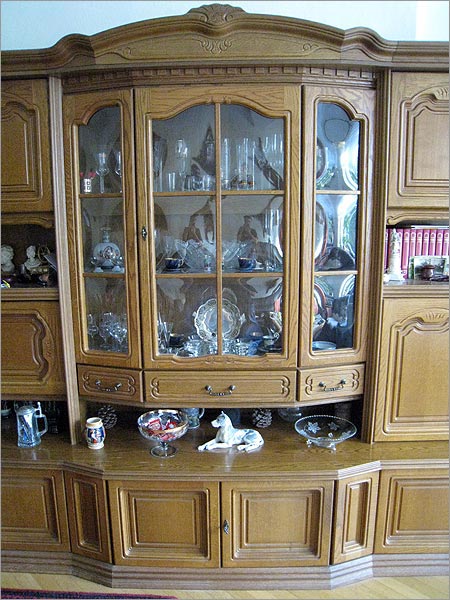
You are a GUI agent. You are given a task and a screenshot of the screen. Output one action in this format:
    pyautogui.click(x=<x>, y=<y>)
    Task: Click on the statue
    
    Given the screenshot: What is the action you would take?
    pyautogui.click(x=395, y=242)